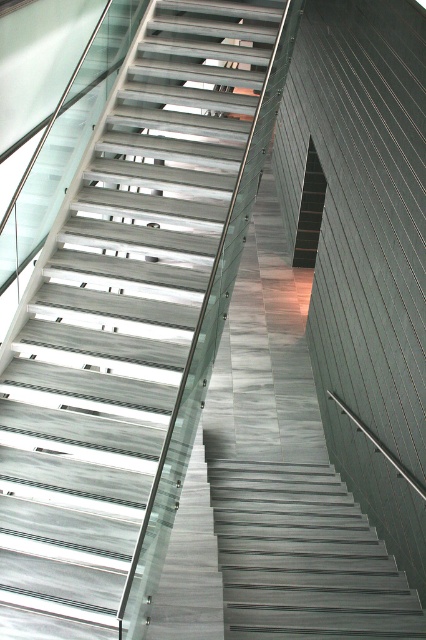
Is point (85, 428) behind point (308, 259)?

No.

Which is above, metallic gray stairs at center or black matte stair at center?

metallic gray stairs at center is higher up.

Which is in front, point (14, 461) or point (319, 202)?

Point (14, 461) is in front.

Locate an element on the screen. metallic gray stairs at center is located at coordinates (121, 317).